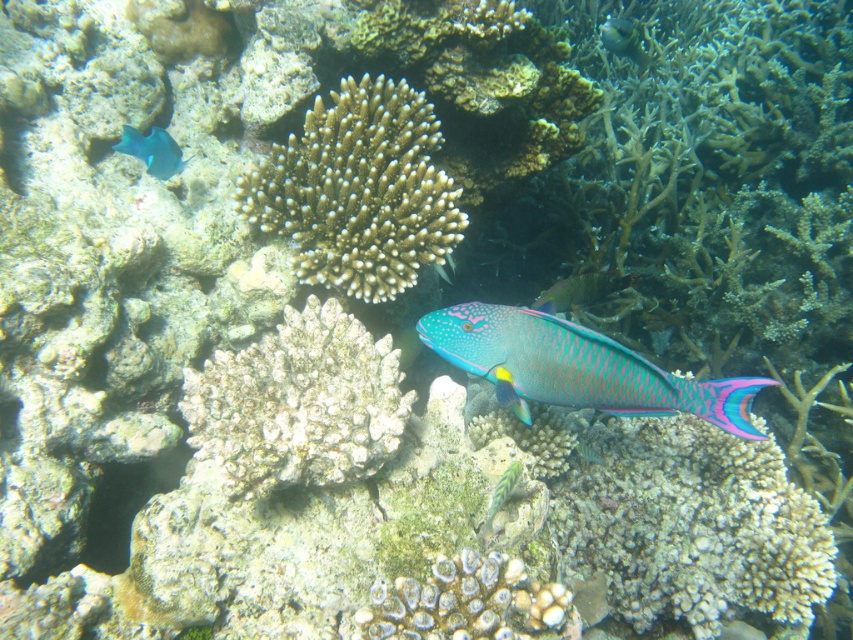
Question: In this image, where is shiny iridescent fish at center located relative to shiny blue-green fish at upper center?

Choices:
 (A) left
 (B) right

Answer: (A)

Question: Observing the image, what is the correct spatial positioning of shiny blue fish at upper left in reference to shiny blue-green fish at upper center?

Choices:
 (A) above
 (B) below

Answer: (B)

Question: Which is farther from the shiny iridescent fish at center?

Choices:
 (A) white coral at center
 (B) shiny blue-green fish at upper center

Answer: (B)

Question: Which point appears closest to the camera in this image?

Choices:
 (A) (408, 180)
 (B) (564, 371)
 (C) (492, 500)

Answer: (B)

Question: Can you confirm if shiny blue fish at upper left is positioned above shiny green fish at center?

Choices:
 (A) yes
 (B) no

Answer: (A)

Question: Which point is farther from the camera taking this photo?

Choices:
 (A) (573, 284)
 (B) (494, 515)
 (C) (730, 432)

Answer: (A)